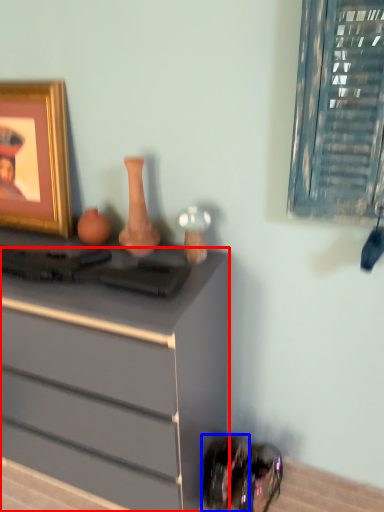
Question: Which of the following is the farthest to the observer, chest of drawers (highlighted by a red box) or shoe (highlighted by a blue box)?

Choices:
 (A) chest of drawers
 (B) shoe

Answer: (B)